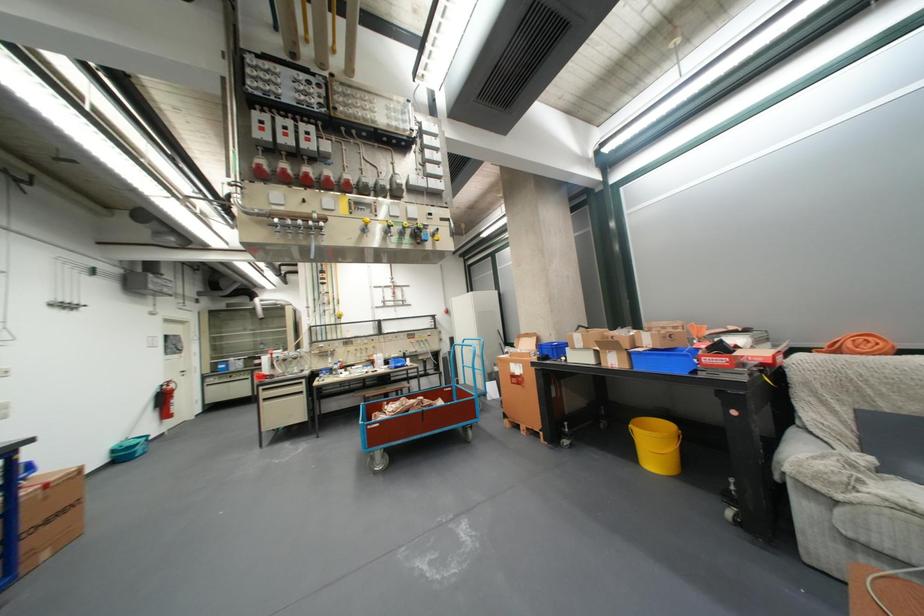
What do you see at coordinates (795, 448) in the screenshot? This screenshot has height=616, width=924. I see `the sofa armrest` at bounding box center [795, 448].